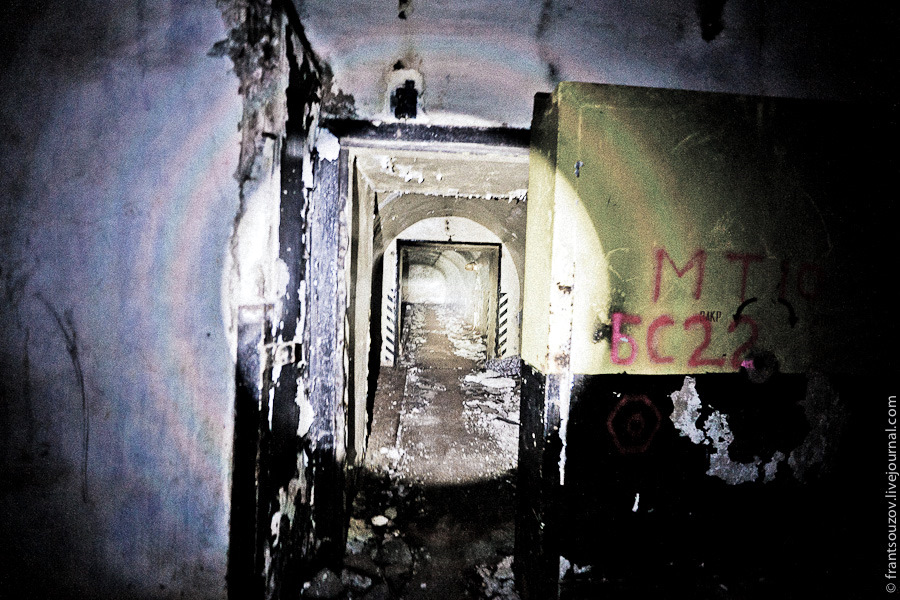
Image resolution: width=900 pixels, height=600 pixels. I want to click on doorway frame, so click(398, 301), click(497, 295).